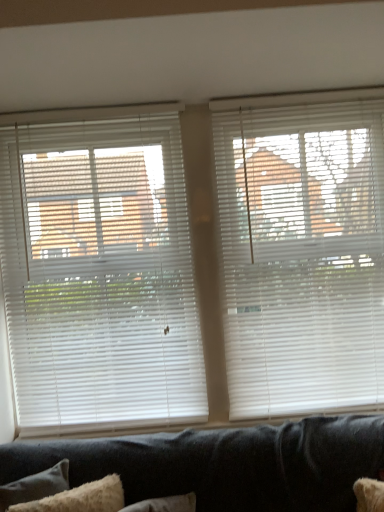
Question: In the image, is white plastic blinds at left, marked as the 2th window blind in a right-to-left arrangement, on the left side or the right side of white plastic blinds at upper right, acting as the 1th window blind starting from the right?

Choices:
 (A) right
 (B) left

Answer: (B)

Question: From the image's perspective, is white plastic blinds at left, the 1th window blind when ordered from left to right, located above or below white plastic blinds at upper right, acting as the 1th window blind starting from the right?

Choices:
 (A) above
 (B) below

Answer: (B)

Question: Considering the real-world distances, which object is closest to the white plastic blinds at left, the 1th window blind when ordered from left to right?

Choices:
 (A) white plastic blinds at upper right, arranged as the second window blind when viewed from the left
 (B) fuzzy white pillow at lower left

Answer: (A)

Question: Estimate the real-world distances between objects in this image. Which object is closer to the fuzzy white pillow at lower left?

Choices:
 (A) white plastic blinds at upper right, arranged as the second window blind when viewed from the left
 (B) white plastic blinds at left, the 1th window blind when ordered from left to right

Answer: (B)